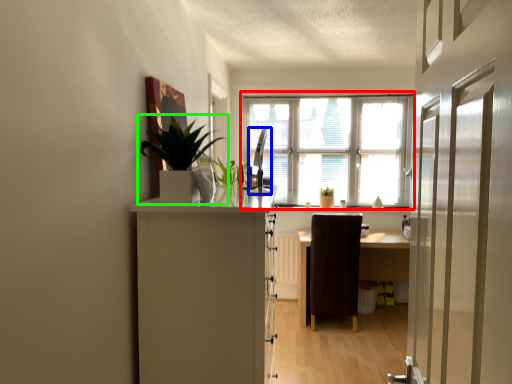
Question: Which object is the closest to the window (highlighted by a red box)? Choose among these: silver (highlighted by a blue box) or houseplant (highlighted by a green box).

Choices:
 (A) silver
 (B) houseplant

Answer: (A)